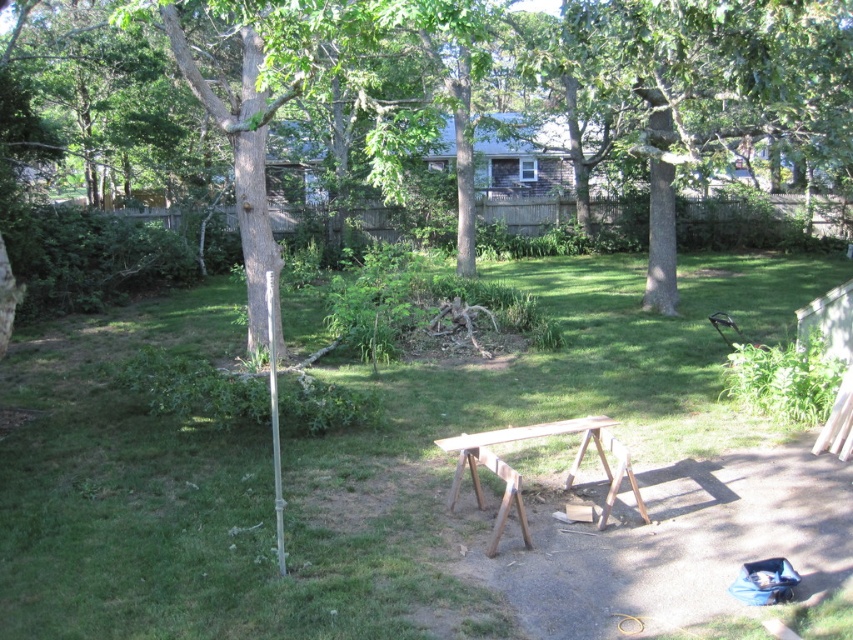
From the picture: Which is below, green grass at center or wooden sawhorse at center?

wooden sawhorse at center

Is point (436, 593) positioned after point (480, 492)?

No, (436, 593) is closer to viewer.

Where is `green grass at center`? green grass at center is located at coordinates pyautogui.click(x=335, y=460).

Can you confirm if green grass at center is positioned above silver metallic pole at left?

No.

Is green grass at center taller than silver metallic pole at left?

Yes, green grass at center is taller than silver metallic pole at left.

Is point (219, 285) in front of point (276, 451)?

No, it is behind (276, 451).

At what (x,y) coordinates should I click in order to perform the action: click on green grass at center. Please return your answer as a coordinate pair (x, y). Image resolution: width=853 pixels, height=640 pixels. Looking at the image, I should click on (335, 460).

Does wooden sawhorse at center appear under silver metallic pole at left?

Yes, wooden sawhorse at center is below silver metallic pole at left.

Does wooden sawhorse at center have a greater height compared to silver metallic pole at left?

In fact, wooden sawhorse at center may be shorter than silver metallic pole at left.

Between point (503, 477) and point (265, 291), which one is positioned in front?

Positioned in front is point (503, 477).

The height and width of the screenshot is (640, 853). What are the coordinates of `wooden sawhorse at center` in the screenshot? It's located at (520, 476).